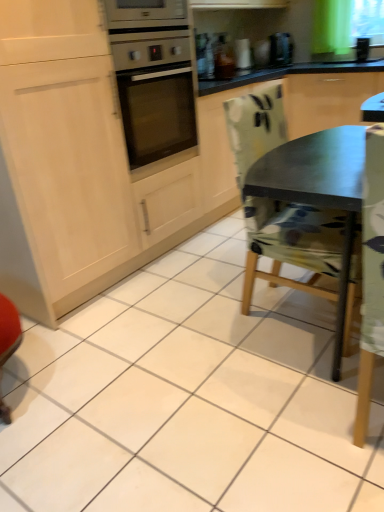
Question: Is camouflage fabric chair at center inside black plastic coffee machine at upper center?

Choices:
 (A) no
 (B) yes

Answer: (A)

Question: Is black plastic coffee machine at upper center thinner than camouflage fabric chair at center?

Choices:
 (A) yes
 (B) no

Answer: (A)

Question: From a real-world perspective, does black plastic coffee machine at upper center stand above camouflage fabric chair at center?

Choices:
 (A) no
 (B) yes

Answer: (B)

Question: Does black plastic coffee machine at upper center have a greater width compared to camouflage fabric chair at center?

Choices:
 (A) no
 (B) yes

Answer: (A)

Question: From the image's perspective, is black plastic coffee machine at upper center below camouflage fabric chair at center?

Choices:
 (A) no
 (B) yes

Answer: (A)

Question: Is black plastic coffee machine at upper center closer to camera compared to camouflage fabric chair at center?

Choices:
 (A) yes
 (B) no

Answer: (B)

Question: Considering the relative sizes of metallic silver toaster at upper center and camouflage fabric chair at center in the image provided, is metallic silver toaster at upper center taller than camouflage fabric chair at center?

Choices:
 (A) no
 (B) yes

Answer: (A)

Question: Does metallic silver toaster at upper center have a lesser height compared to camouflage fabric chair at center?

Choices:
 (A) no
 (B) yes

Answer: (B)

Question: Does metallic silver toaster at upper center appear on the left side of camouflage fabric chair at center?

Choices:
 (A) no
 (B) yes

Answer: (B)

Question: Is metallic silver toaster at upper center in contact with camouflage fabric chair at center?

Choices:
 (A) no
 (B) yes

Answer: (A)

Question: Is there a large distance between metallic silver toaster at upper center and camouflage fabric chair at center?

Choices:
 (A) yes
 (B) no

Answer: (A)

Question: Can you confirm if metallic silver toaster at upper center is bigger than camouflage fabric chair at center?

Choices:
 (A) yes
 (B) no

Answer: (B)

Question: From a real-world perspective, is camouflage fabric chair at center on metallic silver toaster at upper center?

Choices:
 (A) no
 (B) yes

Answer: (A)